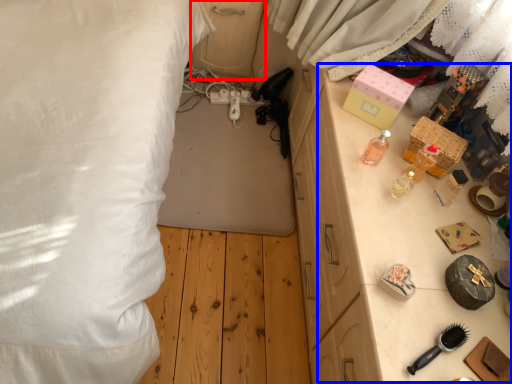
Question: Which object is closer to the camera taking this photo, dresser (highlighted by a red box) or table (highlighted by a blue box)?

Choices:
 (A) dresser
 (B) table

Answer: (B)